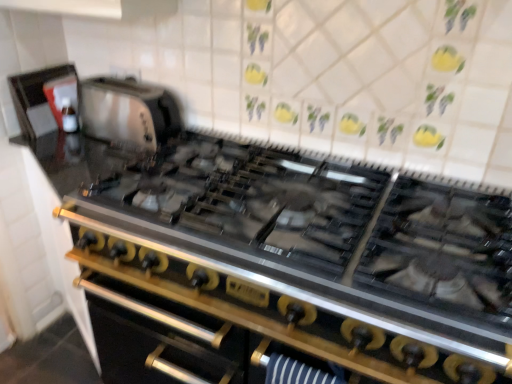
Locate an element on the screen. This screenshot has width=512, height=384. stainless steel gas stove at center is located at coordinates (324, 228).

The height and width of the screenshot is (384, 512). What do you see at coordinates (259, 320) in the screenshot? I see `stainless steel oven at center` at bounding box center [259, 320].

This screenshot has width=512, height=384. In order to click on satin silver toaster at upper left, which appears as the first appliance when viewed from the right in this screenshot , I will do `click(128, 113)`.

This screenshot has width=512, height=384. What do you see at coordinates (34, 96) in the screenshot? I see `matte black kettle at upper left, which ranks as the 1th appliance in left-to-right order` at bounding box center [34, 96].

This screenshot has height=384, width=512. Find the location of `stainless steel gas stove at center`. stainless steel gas stove at center is located at coordinates (324, 228).

Is stainless steel gas stove at center positioned with its back to stainless steel oven at center?

No, stainless steel gas stove at center is not facing the opposite direction of stainless steel oven at center.

Between stainless steel gas stove at center and stainless steel oven at center, which one is positioned behind?

stainless steel oven at center.

You are a GUI agent. You are given a task and a screenshot of the screen. Output one action in this format:
    pyautogui.click(x=<x>, y=<y>)
    Task: Click on the gas stove above the stainless steel oven at center (from the image's perspective)
    The height and width of the screenshot is (384, 512).
    Given the screenshot: What is the action you would take?
    point(324,228)

Based on the photo, from a real-world perspective, who is located lower, stainless steel gas stove at center or stainless steel oven at center?

In real-world perspective, stainless steel oven at center is lower.

Is matte black kettle at upper left, marked as the 2th appliance in a right-to-left arrangement, spatially inside stainless steel gas stove at center, or outside of it?

matte black kettle at upper left, marked as the 2th appliance in a right-to-left arrangement, is not enclosed by stainless steel gas stove at center.

Considering the relative sizes of matte black kettle at upper left, which ranks as the 1th appliance in left-to-right order, and stainless steel gas stove at center in the image provided, is matte black kettle at upper left, which ranks as the 1th appliance in left-to-right order, shorter than stainless steel gas stove at center?

Incorrect, the height of matte black kettle at upper left, which ranks as the 1th appliance in left-to-right order, does not fall short of that of stainless steel gas stove at center.

You are a GUI agent. You are given a task and a screenshot of the screen. Output one action in this format:
    pyautogui.click(x=<x>, y=<y>)
    Task: Click on the gas stove on the right of matte black kettle at upper left, marked as the 2th appliance in a right-to-left arrangement
    This screenshot has height=384, width=512.
    Given the screenshot: What is the action you would take?
    pyautogui.click(x=324, y=228)

Which is in front, point (36, 99) or point (194, 152)?

Point (194, 152)

Which object is further away from the camera taking this photo, stainless steel oven at center or satin silver toaster at upper left, which is counted as the second appliance, starting from the left?

satin silver toaster at upper left, which is counted as the second appliance, starting from the left.

Find the location of a particular element. The width and height of the screenshot is (512, 384). the 1st appliance behind the stainless steel oven at center is located at coordinates (128, 113).

From a real-world perspective, which object rests below the other?

stainless steel oven at center is physically lower.

From the image's perspective, which one is positioned lower, matte black kettle at upper left, which ranks as the 1th appliance in left-to-right order, or stainless steel oven at center?

stainless steel oven at center.

Considering the sizes of matte black kettle at upper left, marked as the 2th appliance in a right-to-left arrangement, and stainless steel oven at center in the image, is matte black kettle at upper left, marked as the 2th appliance in a right-to-left arrangement, taller or shorter than stainless steel oven at center?

In the image, matte black kettle at upper left, marked as the 2th appliance in a right-to-left arrangement, appears to be shorter than stainless steel oven at center.

Is matte black kettle at upper left, marked as the 2th appliance in a right-to-left arrangement, positioned in front of stainless steel oven at center?

No, it is behind stainless steel oven at center.

How many degrees apart are the facing directions of matte black kettle at upper left, marked as the 2th appliance in a right-to-left arrangement, and stainless steel oven at center?

The facing directions of matte black kettle at upper left, marked as the 2th appliance in a right-to-left arrangement, and stainless steel oven at center are 89.9 degrees apart.

What are the coordinates of `oven lying behind the stainless steel gas stove at center` in the screenshot? It's located at (259, 320).

Is stainless steel oven at center oriented away from stainless steel gas stove at center?

stainless steel oven at center does not have its back to stainless steel gas stove at center.

Is stainless steel gas stove at center inside stainless steel oven at center?

That's incorrect, stainless steel gas stove at center is not inside stainless steel oven at center.

Based on their sizes in the image, would you say matte black kettle at upper left, marked as the 2th appliance in a right-to-left arrangement, is bigger or smaller than satin silver toaster at upper left, which is counted as the second appliance, starting from the left?

In the image, matte black kettle at upper left, marked as the 2th appliance in a right-to-left arrangement, appears to be smaller than satin silver toaster at upper left, which is counted as the second appliance, starting from the left.

Find the location of a particular element. The image size is (512, 384). appliance on the right of matte black kettle at upper left, which ranks as the 1th appliance in left-to-right order is located at coordinates (x=128, y=113).

Which is in front, point (75, 74) or point (130, 145)?

The point (130, 145) is more forward.

Which is correct: matte black kettle at upper left, which ranks as the 1th appliance in left-to-right order, is inside satin silver toaster at upper left, which is counted as the second appliance, starting from the left, or outside of it?

matte black kettle at upper left, which ranks as the 1th appliance in left-to-right order, lies outside satin silver toaster at upper left, which is counted as the second appliance, starting from the left.

Is matte black kettle at upper left, which ranks as the 1th appliance in left-to-right order, a part of stainless steel gas stove at center?

No.

Is stainless steel gas stove at center facing away from matte black kettle at upper left, marked as the 2th appliance in a right-to-left arrangement?

No, stainless steel gas stove at center is not facing the opposite direction of matte black kettle at upper left, marked as the 2th appliance in a right-to-left arrangement.

Identify the location of gas stove lying below the matte black kettle at upper left, which ranks as the 1th appliance in left-to-right order (from the image's perspective). (324, 228).

Where is `gas stove on the right of stainless steel oven at center`? The height and width of the screenshot is (384, 512). gas stove on the right of stainless steel oven at center is located at coordinates (324, 228).

Where is `gas stove in front of the matte black kettle at upper left, which ranks as the 1th appliance in left-to-right order`? Image resolution: width=512 pixels, height=384 pixels. gas stove in front of the matte black kettle at upper left, which ranks as the 1th appliance in left-to-right order is located at coordinates (324, 228).

Based on their spatial positions, is satin silver toaster at upper left, which appears as the first appliance when viewed from the right, or stainless steel gas stove at center further from matte black kettle at upper left, which ranks as the 1th appliance in left-to-right order?

stainless steel gas stove at center.

Estimate the real-world distances between objects in this image. Which object is further from stainless steel gas stove at center, stainless steel oven at center or matte black kettle at upper left, marked as the 2th appliance in a right-to-left arrangement?

matte black kettle at upper left, marked as the 2th appliance in a right-to-left arrangement, is positioned further to the anchor stainless steel gas stove at center.

Which object lies nearer to the anchor point stainless steel oven at center, matte black kettle at upper left, marked as the 2th appliance in a right-to-left arrangement, or stainless steel gas stove at center?

Among the two, stainless steel gas stove at center is located nearer to stainless steel oven at center.

Looking at this image, estimate the real-world distances between objects in this image. Which object is further from satin silver toaster at upper left, which appears as the first appliance when viewed from the right, stainless steel gas stove at center or stainless steel oven at center?

The object further to satin silver toaster at upper left, which appears as the first appliance when viewed from the right, is stainless steel oven at center.

From the picture: When comparing their distances from stainless steel gas stove at center, does stainless steel oven at center or satin silver toaster at upper left, which is counted as the second appliance, starting from the left, seem closer?

stainless steel oven at center lies closer to stainless steel gas stove at center than the other object.

Looking at the image, which one is located further to matte black kettle at upper left, which ranks as the 1th appliance in left-to-right order, stainless steel gas stove at center or stainless steel oven at center?

stainless steel gas stove at center lies further to matte black kettle at upper left, which ranks as the 1th appliance in left-to-right order, than the other object.

Based on their spatial positions, is satin silver toaster at upper left, which appears as the first appliance when viewed from the right, or stainless steel oven at center further from stainless steel gas stove at center?

Based on the image, satin silver toaster at upper left, which appears as the first appliance when viewed from the right, appears to be further to stainless steel gas stove at center.

From the image, which object appears to be nearer to satin silver toaster at upper left, which is counted as the second appliance, starting from the left, stainless steel oven at center or stainless steel gas stove at center?

stainless steel gas stove at center.

Identify the location of oven between matte black kettle at upper left, which ranks as the 1th appliance in left-to-right order, and stainless steel gas stove at center, in the horizontal direction. (259, 320).

Identify the location of appliance between matte black kettle at upper left, marked as the 2th appliance in a right-to-left arrangement, and stainless steel oven at center from top to bottom. (128, 113).

Locate an element on the screen. The width and height of the screenshot is (512, 384). appliance located between stainless steel gas stove at center and matte black kettle at upper left, marked as the 2th appliance in a right-to-left arrangement, in the depth direction is located at coordinates (128, 113).

Locate an element on the screen. gas stove between satin silver toaster at upper left, which is counted as the second appliance, starting from the left, and stainless steel oven at center in the up-down direction is located at coordinates (324, 228).